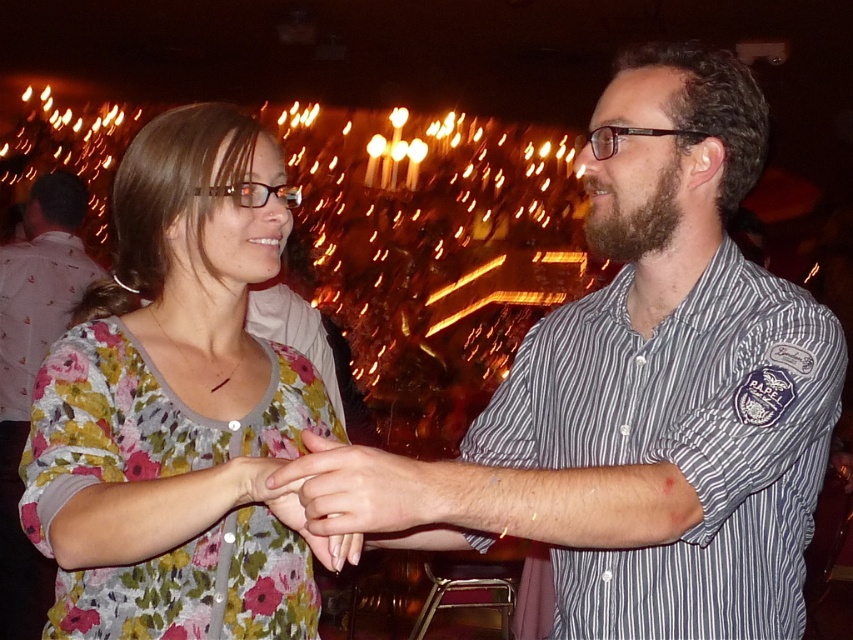
You are standing in the center of the room and want to hand a gift to the person wearing the striped cotton shirt at center. In which direction should you move to reach them?

The striped cotton shirt at center is located at point 0.616 on the x axis and 0.750 on the y axis, so you should move towards the lower right direction to reach them.

You are standing in a dimly lit social gathering and want to reach a specific point in the room. The coordinates of this point are point [706,132]. If you are exactly 1.37 meters away from this point, can you confirm if you are standing directly in front of it?

The distance of point [706,132] from the viewer is 1.37 meters, so yes, you are standing directly in front of point [706,132] at that distance.

Based on the photo, in the image, there are two people. The woman on the left is wearing a floral top, and the man on the right is wearing a striped cotton shirt at right. Based on their positions, can you determine which person is closer to the background lights?

The striped cotton shirt at right is positioned at point (682, 445), which is closer to the background lights than the woman on the left. Therefore, the man on the right is closer to the background lights.